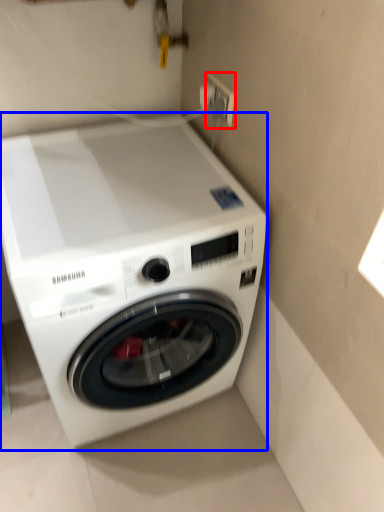
Question: Which point is further to the camera, electric outlet (highlighted by a red box) or washing machine (highlighted by a blue box)?

Choices:
 (A) electric outlet
 (B) washing machine

Answer: (A)